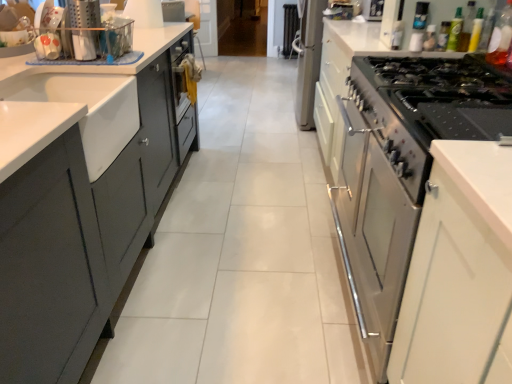
Question: Should I look upward or downward to see transparent plastic bottle at upper right, placed as the 1th bottle when sorted from right to left?

Choices:
 (A) up
 (B) down

Answer: (A)

Question: Would you say green matte bottle at upper right, positioned as the fifth bottle in right-to-left order, is outside green glass bottle at upper right, marked as the 1th bottle in a left-to-right arrangement?

Choices:
 (A) yes
 (B) no

Answer: (A)

Question: Can you confirm if green matte bottle at upper right, which is the second bottle in left-to-right order, is smaller than green glass bottle at upper right, marked as the 1th bottle in a left-to-right arrangement?

Choices:
 (A) no
 (B) yes

Answer: (A)

Question: Does green matte bottle at upper right, which is the second bottle in left-to-right order, turn towards green glass bottle at upper right, marked as the 1th bottle in a left-to-right arrangement?

Choices:
 (A) no
 (B) yes

Answer: (A)

Question: Can you confirm if green matte bottle at upper right, which is the second bottle in left-to-right order, is positioned to the left of green glass bottle at upper right, marked as the 1th bottle in a left-to-right arrangement?

Choices:
 (A) yes
 (B) no

Answer: (B)

Question: Can you confirm if green matte bottle at upper right, which is the second bottle in left-to-right order, is shorter than green glass bottle at upper right, marked as the 1th bottle in a left-to-right arrangement?

Choices:
 (A) no
 (B) yes

Answer: (A)

Question: From a real-world perspective, is green matte bottle at upper right, which is the second bottle in left-to-right order, physically above green glass bottle at upper right, the sixth bottle in the right-to-left sequence?

Choices:
 (A) yes
 (B) no

Answer: (A)

Question: Is translucent plastic bottle at upper right, the third bottle viewed from the right, a part of green plastic bottle at upper right, which is the 2th bottle from right to left?

Choices:
 (A) yes
 (B) no

Answer: (B)

Question: Does green plastic bottle at upper right, which is the 2th bottle from right to left, appear on the right side of translucent plastic bottle at upper right, which is counted as the 4th bottle, starting from the left?

Choices:
 (A) yes
 (B) no

Answer: (A)

Question: From a real-world perspective, is green plastic bottle at upper right, which ranks as the fifth bottle in left-to-right order, on top of translucent plastic bottle at upper right, the third bottle viewed from the right?

Choices:
 (A) yes
 (B) no

Answer: (B)

Question: Is green plastic bottle at upper right, which ranks as the fifth bottle in left-to-right order, located outside translucent plastic bottle at upper right, which is counted as the 4th bottle, starting from the left?

Choices:
 (A) yes
 (B) no

Answer: (A)

Question: Is green plastic bottle at upper right, which ranks as the fifth bottle in left-to-right order, bigger than translucent plastic bottle at upper right, the third bottle viewed from the right?

Choices:
 (A) no
 (B) yes

Answer: (A)

Question: Is green plastic bottle at upper right, which is the 2th bottle from right to left, at the left side of translucent plastic bottle at upper right, which is counted as the 4th bottle, starting from the left?

Choices:
 (A) yes
 (B) no

Answer: (B)

Question: From the image's perspective, is translucent plastic bottle at upper right, the third bottle viewed from the right, located above matte plastic utensil holder at upper left?

Choices:
 (A) yes
 (B) no

Answer: (A)